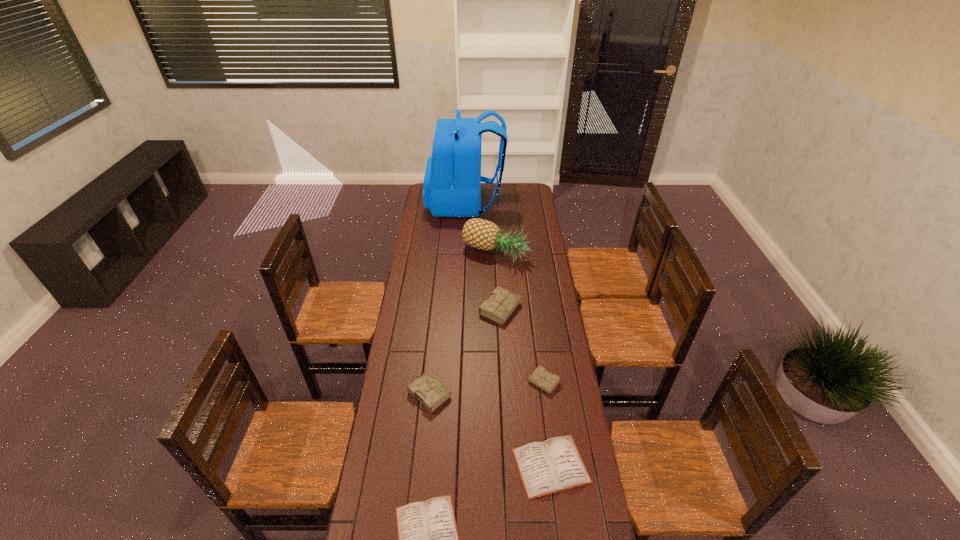
Find the location of a particular element. the right white diary is located at coordinates (554, 465).

At what (x,y) coordinates should I click in order to perform the action: click on the second shortest object. Please return your answer as a coordinate pair (x, y). The height and width of the screenshot is (540, 960). Looking at the image, I should click on (554, 465).

Image resolution: width=960 pixels, height=540 pixels. Identify the location of blank space located 0.170m on the back of the backpack. (531, 203).

This screenshot has width=960, height=540. Identify the location of vacant space located on the back of the second farthest object. (494, 212).

Find the location of a particular element. The image size is (960, 540). vacant space situated 0.260m on the left of the third farthest object is located at coordinates (423, 309).

The image size is (960, 540). In order to click on free location located on the front of the fourth shortest diary in this screenshot , I will do `click(423, 454)`.

Where is `vacant space located 0.050m on the right of the smallest green diary`? vacant space located 0.050m on the right of the smallest green diary is located at coordinates (572, 383).

Where is `free point located 0.240m on the left of the right white diary`? The image size is (960, 540). free point located 0.240m on the left of the right white diary is located at coordinates (443, 466).

I want to click on object situated at the far edge, so click(x=452, y=183).

The image size is (960, 540). What are the coordinates of `backpack situated at the left edge` in the screenshot? It's located at (452, 183).